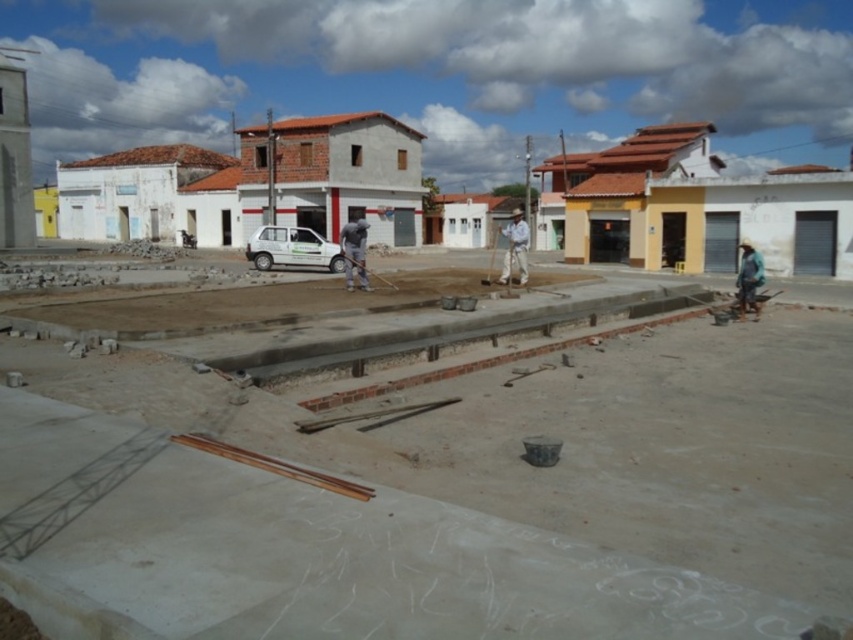
Is gray matte shirt at center below blue fabric shirt at right?

Incorrect, gray matte shirt at center is not positioned below blue fabric shirt at right.

Who is higher up, gray matte shirt at center or blue fabric shirt at right?

gray matte shirt at center is above.

This screenshot has width=853, height=640. Find the location of `gray matte shirt at center`. gray matte shirt at center is located at coordinates (354, 252).

Does gray matte shirt at center have a smaller size compared to white cotton shirt at center?

Yes, gray matte shirt at center is smaller than white cotton shirt at center.

Who is more forward, (364, 276) or (515, 257)?

Point (364, 276)

The height and width of the screenshot is (640, 853). Identify the location of gray matte shirt at center. pyautogui.click(x=354, y=252).

Is smooth concrete surface at center closer to camera compared to blue fabric shirt at right?

Yes, it is in front of blue fabric shirt at right.

Does point (222, 476) come closer to viewer compared to point (746, 285)?

Yes.

Where is `smooth concrete surface at center`? This screenshot has height=640, width=853. smooth concrete surface at center is located at coordinates (462, 493).